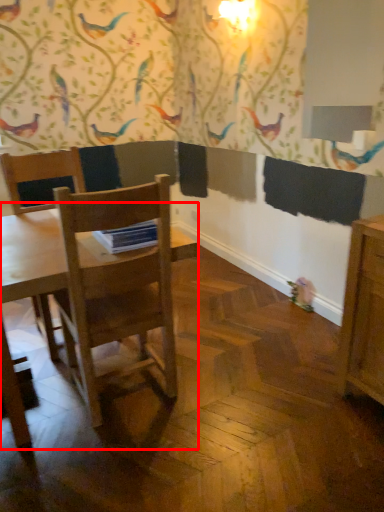
Question: Considering the relative positions of table (annotated by the red box) and chair in the image provided, where is table (annotated by the red box) located with respect to the staircase?

Choices:
 (A) left
 (B) right

Answer: (B)